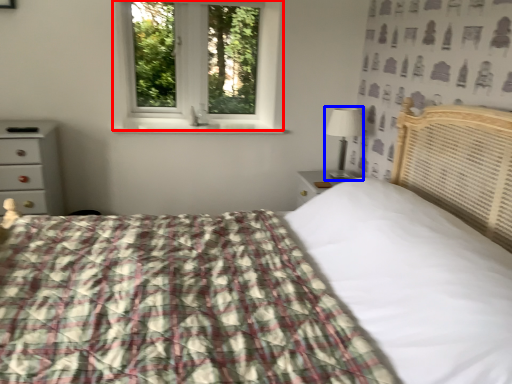
Question: Which object appears closest to the camera in this image, window (highlighted by a red box) or table lamp (highlighted by a blue box)?

Choices:
 (A) window
 (B) table lamp

Answer: (B)